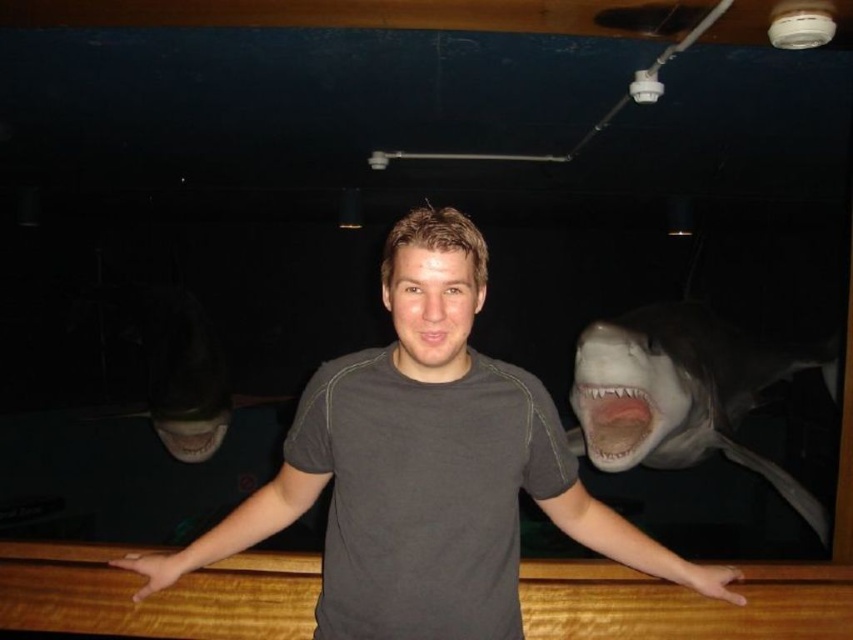
Can you confirm if white glossy shark at right is positioned to the right of pink matte mouth at center?

Correct, you'll find white glossy shark at right to the right of pink matte mouth at center.

Between white glossy shark at right and pink matte mouth at center, which one has less height?

pink matte mouth at center is shorter.

At what (x,y) coordinates should I click in order to perform the action: click on white glossy shark at right. Please return your answer as a coordinate pair (x, y). Looking at the image, I should click on 679,394.

Is point (399, 232) farther from camera compared to point (729, 412)?

No, it is in front of (729, 412).

Is point (479, 621) positioned in front of point (744, 456)?

Yes, point (479, 621) is in front of point (744, 456).

Is point (448, 234) less distant than point (738, 452)?

Yes.

You are a GUI agent. You are given a task and a screenshot of the screen. Output one action in this format:
    pyautogui.click(x=<x>, y=<y>)
    Task: Click on the gray cotton t-shirt at center
    The height and width of the screenshot is (640, 853).
    Given the screenshot: What is the action you would take?
    pyautogui.click(x=426, y=468)

Which is more to the left, gray cotton t-shirt at center or pink matte mouth at center?

pink matte mouth at center

Is gray cotton t-shirt at center bigger than pink matte mouth at center?

Yes.

Is point (398, 604) positioned behind point (416, 330)?

Yes, point (398, 604) is behind point (416, 330).

Locate an element on the screen. gray cotton t-shirt at center is located at coordinates click(x=426, y=468).